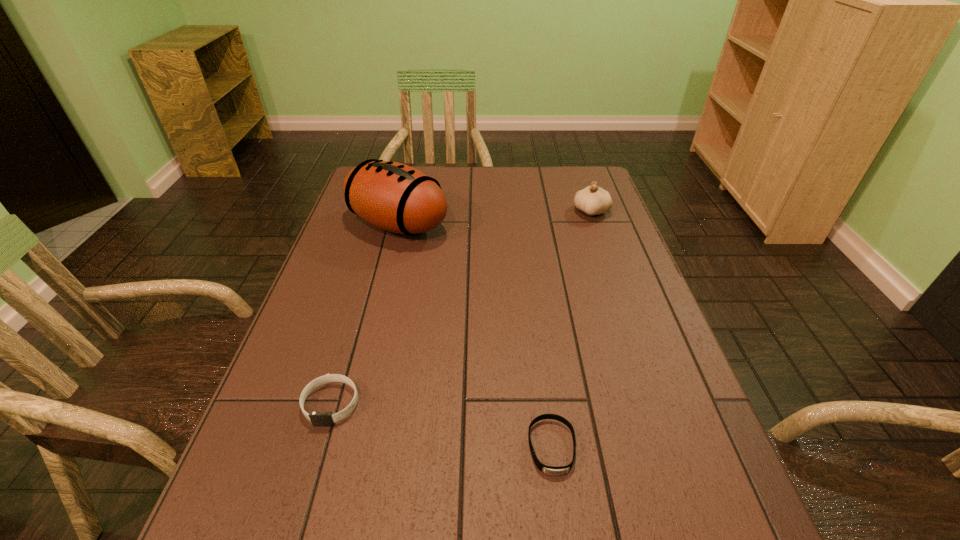
This screenshot has height=540, width=960. In order to click on vacant space situated 0.060m on the display of the second object from right to left in this screenshot , I will do `click(561, 515)`.

Locate an element on the screen. The width and height of the screenshot is (960, 540). object located at the far edge is located at coordinates (392, 196).

The width and height of the screenshot is (960, 540). Identify the location of football (American) located at the left edge. (392, 196).

In order to click on wristband located in the left edge section of the desktop in this screenshot , I will do `click(317, 418)`.

Identify the location of object present at the right edge. This screenshot has width=960, height=540. (593, 200).

Where is `object that is at the far left corner`? The height and width of the screenshot is (540, 960). object that is at the far left corner is located at coordinates (392, 196).

The width and height of the screenshot is (960, 540). Find the location of `blank space at the far edge`. blank space at the far edge is located at coordinates (499, 181).

The image size is (960, 540). Identify the location of free space at the left edge of the desktop. pyautogui.click(x=286, y=446).

In the image, there is a desktop. Where is `free space at the right edge`? This screenshot has width=960, height=540. free space at the right edge is located at coordinates (638, 368).

In order to click on vacant area that lies between the shortest object and the rightmost object in this screenshot , I will do `click(571, 329)`.